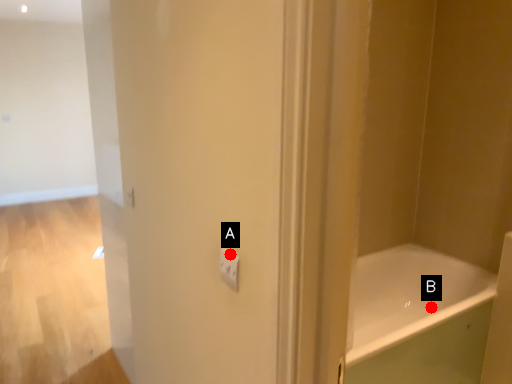
Question: Two points are circled on the image, labeled by A and B beside each circle. Which point is farther to the camera?

Choices:
 (A) A is further
 (B) B is further

Answer: (B)